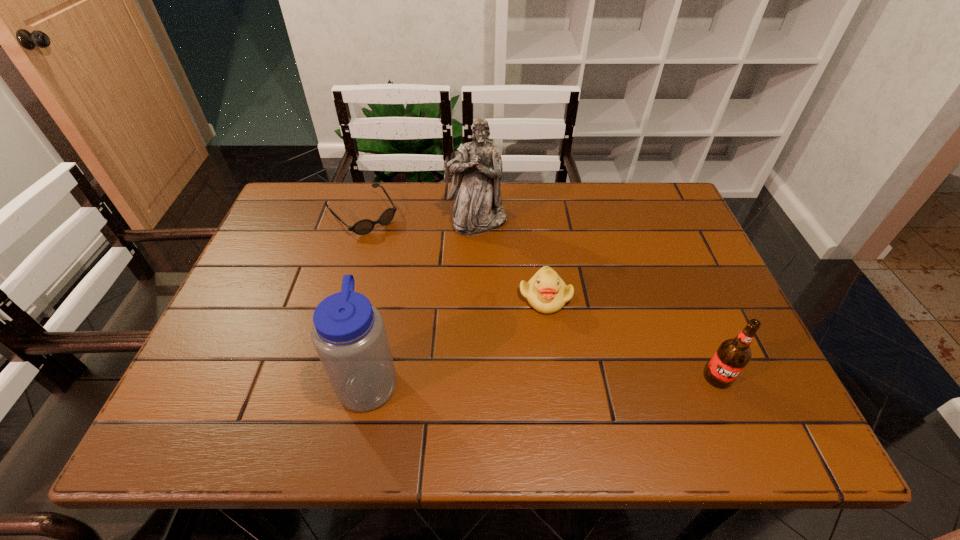
Locate an element on the screen. Image resolution: width=960 pixels, height=540 pixels. water bottle is located at coordinates (349, 335).

Image resolution: width=960 pixels, height=540 pixels. I want to click on the rightmost object, so click(732, 356).

Identify the location of the third tallest object. (732, 356).

The image size is (960, 540). In order to click on duckling in this screenshot , I will do `click(546, 292)`.

The height and width of the screenshot is (540, 960). Identify the location of the fourth tallest object. (546, 292).

This screenshot has height=540, width=960. Find the location of `the third object from left to right`. the third object from left to right is located at coordinates (477, 170).

This screenshot has width=960, height=540. I want to click on figurine, so click(477, 170).

This screenshot has height=540, width=960. What are the coordinates of `sunglasses` in the screenshot? It's located at (365, 226).

This screenshot has height=540, width=960. I want to click on free space located with a carrying loop on the side of the second tallest object, so click(589, 380).

The image size is (960, 540). I want to click on free space located on the back of the root beer, so click(x=669, y=263).